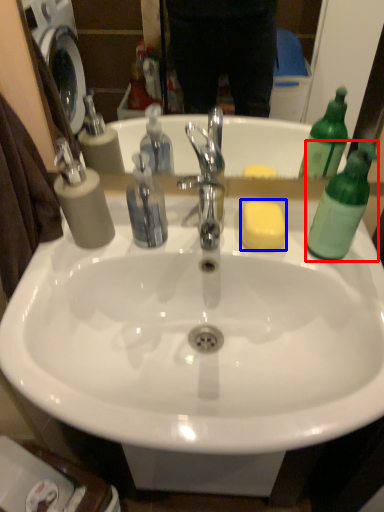
Question: Which point is further to the camera, bottle (highlighted by a red box) or soap (highlighted by a blue box)?

Choices:
 (A) bottle
 (B) soap

Answer: (B)